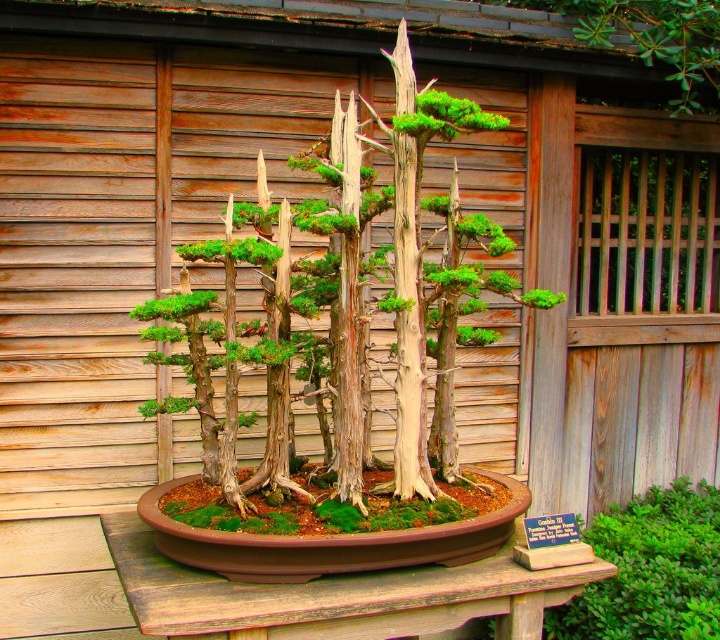
You are standing in the garden and want to find the green textured bonsai at center. Based on the coordinates provided, where should you look?

The green textured bonsai at center is located at the coordinates point (350, 300), so you should look towards the center of the image.

You are a gardener who wants to move the green textured bonsai at center to a new location. The brown wooden table at center is currently in the way. Can you lift the bonsai without moving the table?

The green textured bonsai at center has a larger size compared to brown wooden table at center, so it is not possible to lift the bonsai without moving the table first because the bonsai is bigger and likely heavier than the table.